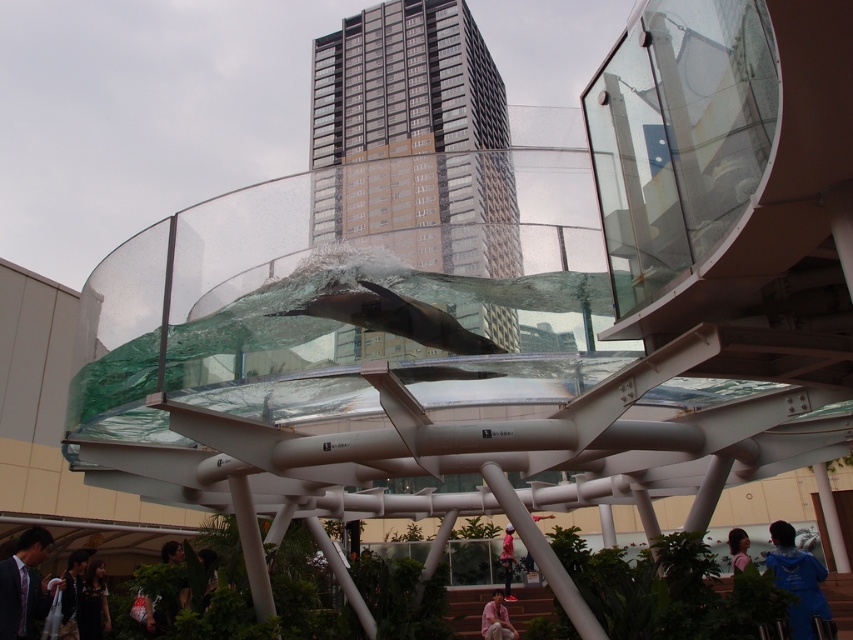
Does dark suit at lower left appear on the left side of blue fabric at lower right?

Correct, you'll find dark suit at lower left to the left of blue fabric at lower right.

Can you confirm if dark suit at lower left is thinner than blue fabric at lower right?

Correct, dark suit at lower left's width is less than blue fabric at lower right's.

Does point (10, 625) come in front of point (770, 529)?

Yes.

Where is `dark suit at lower left`? This screenshot has height=640, width=853. dark suit at lower left is located at coordinates pyautogui.click(x=22, y=586).

Can you confirm if dark suit at lower left is positioned below dark gray fabric jacket at lower left?

Incorrect, dark suit at lower left is not positioned below dark gray fabric jacket at lower left.

Does point (22, 598) come farther from viewer compared to point (70, 627)?

No, (22, 598) is closer to viewer.

Between point (3, 596) and point (74, 563), which one is positioned in front?

Point (3, 596) is more forward.

Where is `dark suit at lower left`? This screenshot has height=640, width=853. dark suit at lower left is located at coordinates pyautogui.click(x=22, y=586).

Does dark suit at lower left have a greater width compared to light blue fabric person at lower center?

Yes.

Can you confirm if dark suit at lower left is smaller than light blue fabric person at lower center?

Yes, dark suit at lower left is smaller than light blue fabric person at lower center.

What do you see at coordinates (22, 586) in the screenshot? Image resolution: width=853 pixels, height=640 pixels. I see `dark suit at lower left` at bounding box center [22, 586].

The height and width of the screenshot is (640, 853). Find the location of `dark suit at lower left`. dark suit at lower left is located at coordinates (22, 586).